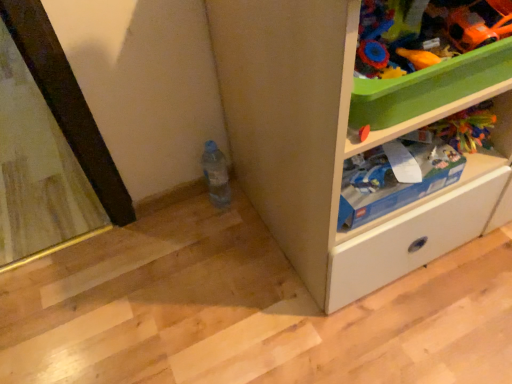
The image size is (512, 384). I want to click on vacant area situated to the left side of translucent plastic bottle at lower center, so click(x=172, y=217).